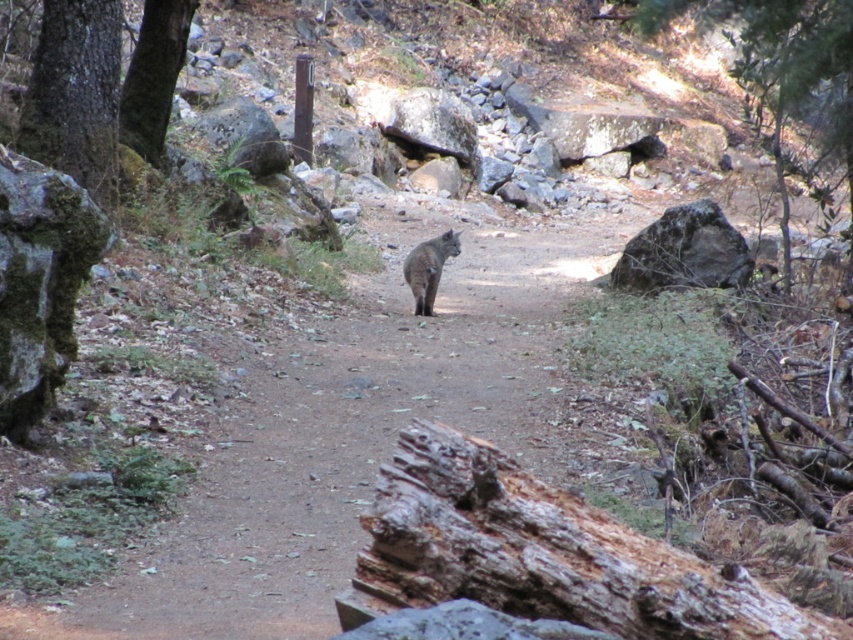
You are a hiker with a camera that has a maximum zoom range of 8 meters. You want to take a closeup photo of the green leafy tree at upper right. Can your camera zoom far enough to capture the tree clearly?

The green leafy tree at upper right is 8.55 meters away from the camera. Since the camera can only zoom up to 8 meters, it cannot reach the required distance. Therefore, the camera cannot capture the tree clearly with its current zoom range.